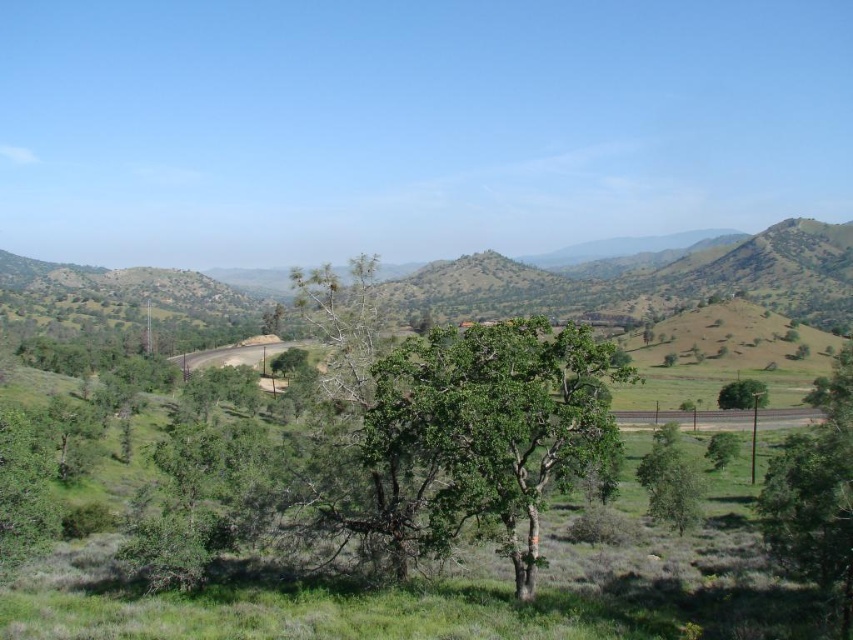
Is point (524, 577) more distant than point (35, 432)?

No, (524, 577) is closer to viewer.

Does point (584, 326) come in front of point (18, 442)?

Yes, point (584, 326) is in front of point (18, 442).

The height and width of the screenshot is (640, 853). Find the location of `green leafy tree at center`. green leafy tree at center is located at coordinates (496, 422).

Between green leafy tree at center and green leafy tree at right, which one appears on the right side from the viewer's perspective?

Positioned to the right is green leafy tree at right.

Does point (532, 364) come farther from viewer compared to point (755, 390)?

No, it is not.

Image resolution: width=853 pixels, height=640 pixels. Describe the element at coordinates (496, 422) in the screenshot. I see `green leafy tree at center` at that location.

Locate an element on the screen. Image resolution: width=853 pixels, height=640 pixels. green leafy tree at center is located at coordinates (496, 422).

Can you confirm if green leafy tree at lower left is positioned below green leafy tree at right?

Incorrect, green leafy tree at lower left is not positioned below green leafy tree at right.

Does green leafy tree at lower left have a greater height compared to green leafy tree at right?

No.

Find the location of a particular element. This screenshot has height=640, width=853. green leafy tree at lower left is located at coordinates coord(22,492).